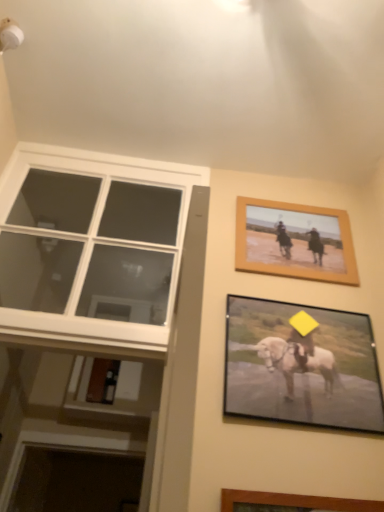
Question: From the image's perspective, is matte black picture frame at lower right, arranged as the 1th picture frame when ordered from the bottom, beneath wooden framed picture at upper right, marked as the first picture frame in a back-to-front arrangement?

Choices:
 (A) yes
 (B) no

Answer: (A)

Question: From a real-world perspective, is matte black picture frame at lower right, arranged as the 1th picture frame when ordered from the bottom, beneath wooden framed picture at upper right, the second picture frame from the front?

Choices:
 (A) yes
 (B) no

Answer: (A)

Question: Can you confirm if matte black picture frame at lower right, the first picture frame positioned from the front, is taller than wooden framed picture at upper right, marked as the first picture frame in a back-to-front arrangement?

Choices:
 (A) yes
 (B) no

Answer: (A)

Question: Considering the relative positions of matte black picture frame at lower right, which is the 2th picture frame from back to front, and wooden framed picture at upper right, the first picture frame viewed from the top, in the image provided, is matte black picture frame at lower right, which is the 2th picture frame from back to front, behind wooden framed picture at upper right, the first picture frame viewed from the top,?

Choices:
 (A) no
 (B) yes

Answer: (A)

Question: Can we say matte black picture frame at lower right, the first picture frame positioned from the front, lies outside wooden framed picture at upper right, the second picture frame from the front?

Choices:
 (A) no
 (B) yes

Answer: (B)

Question: Considering the relative sizes of matte black picture frame at lower right, the first picture frame positioned from the front, and wooden framed picture at upper right, placed as the 2th picture frame when sorted from bottom to top, in the image provided, is matte black picture frame at lower right, the first picture frame positioned from the front, bigger than wooden framed picture at upper right, placed as the 2th picture frame when sorted from bottom to top,?

Choices:
 (A) no
 (B) yes

Answer: (B)

Question: Is white glass window at left not near matte black picture frame at lower right, arranged as the 1th picture frame when ordered from the bottom?

Choices:
 (A) yes
 (B) no

Answer: (B)

Question: Can you confirm if white glass window at left is positioned to the right of matte black picture frame at lower right, the first picture frame positioned from the front?

Choices:
 (A) no
 (B) yes

Answer: (A)

Question: From the image's perspective, is white glass window at left on matte black picture frame at lower right, which is the 2th picture frame from back to front?

Choices:
 (A) yes
 (B) no

Answer: (A)

Question: Is the depth of white glass window at left less than that of matte black picture frame at lower right, the second picture frame in the top-to-bottom sequence?

Choices:
 (A) yes
 (B) no

Answer: (B)

Question: Does white glass window at left have a greater height compared to matte black picture frame at lower right, which is the 2th picture frame from back to front?

Choices:
 (A) yes
 (B) no

Answer: (A)

Question: Considering the relative sizes of white glass window at left and matte black picture frame at lower right, arranged as the 1th picture frame when ordered from the bottom, in the image provided, is white glass window at left thinner than matte black picture frame at lower right, arranged as the 1th picture frame when ordered from the bottom,?

Choices:
 (A) no
 (B) yes

Answer: (A)

Question: Considering the relative sizes of matte black picture frame at lower right, which is the 2th picture frame from back to front, and white glass window at left in the image provided, is matte black picture frame at lower right, which is the 2th picture frame from back to front, taller than white glass window at left?

Choices:
 (A) yes
 (B) no

Answer: (B)